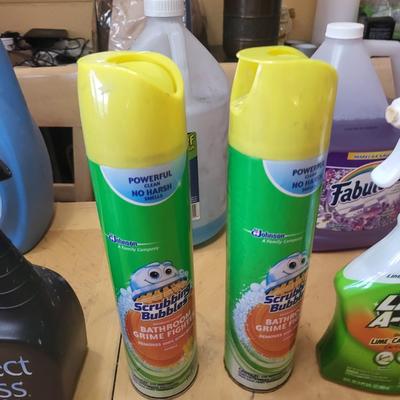
What are the coordinates of `part of a spray bottle of cleaner` in the screenshot? It's located at (163, 300), (377, 291).